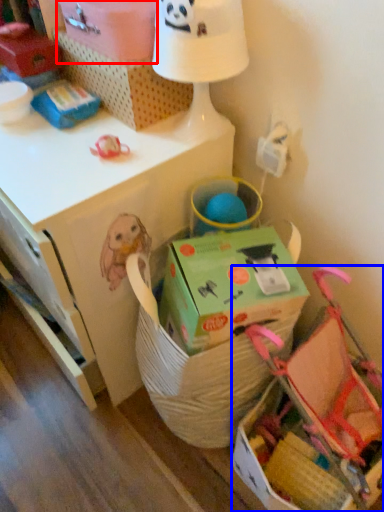
Question: Which object is further to the camera taking this photo, cardboard box (highlighted by a red box) or baby carriage (highlighted by a blue box)?

Choices:
 (A) cardboard box
 (B) baby carriage

Answer: (A)